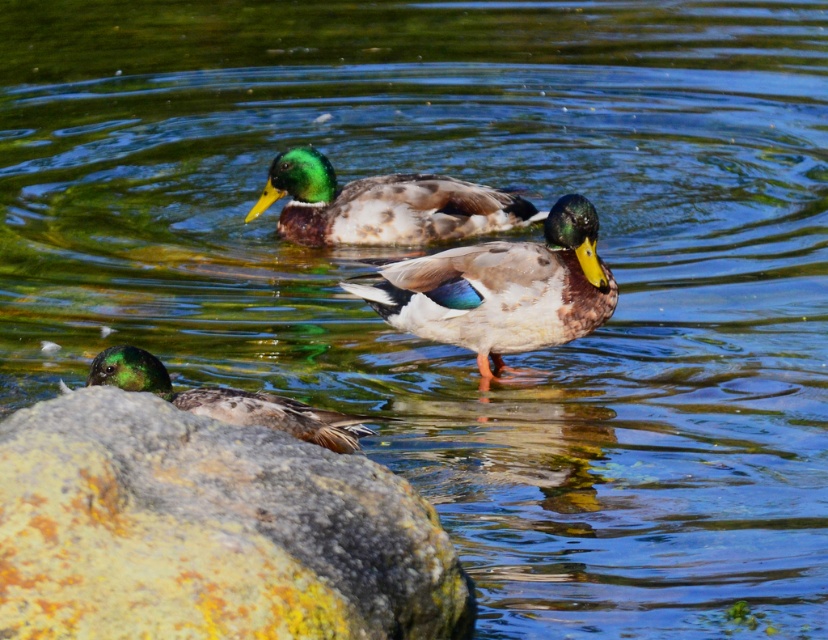
Question: Is shiny brown duck at center to the left of shiny green head at upper center from the viewer's perspective?

Choices:
 (A) no
 (B) yes

Answer: (A)

Question: Which object is positioned closest to the green glossy duck at lower left?

Choices:
 (A) speckled rock at lower left
 (B) shiny brown duck at center
 (C) shiny green head at upper center

Answer: (A)

Question: Is shiny brown duck at center smaller than shiny green head at upper center?

Choices:
 (A) yes
 (B) no

Answer: (B)

Question: Which point is closer to the camera?

Choices:
 (A) shiny green head at upper center
 (B) speckled rock at lower left

Answer: (B)

Question: Which of the following is the farthest from the observer?

Choices:
 (A) speckled rock at lower left
 (B) shiny brown duck at center
 (C) green glossy duck at lower left

Answer: (B)

Question: In this image, where is speckled rock at lower left located relative to shiny green head at upper center?

Choices:
 (A) above
 (B) below

Answer: (B)